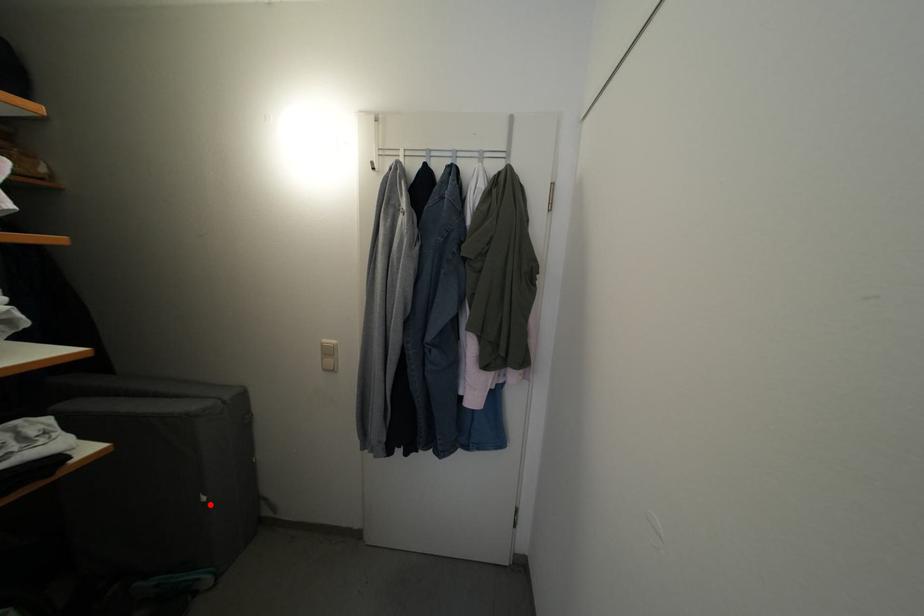
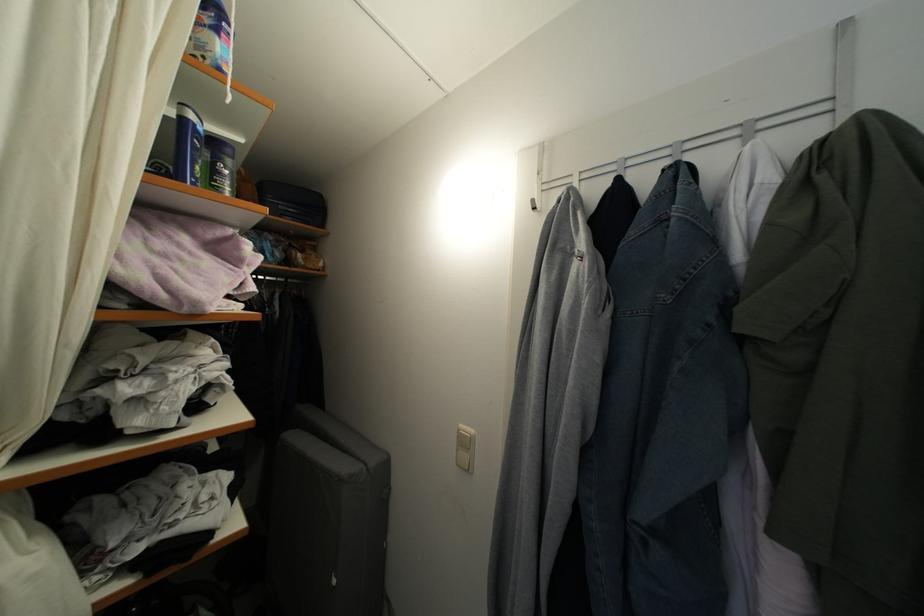
The point at the highlighted location is marked in the first image. Where is the corresponding point in the second image?

(339, 588)